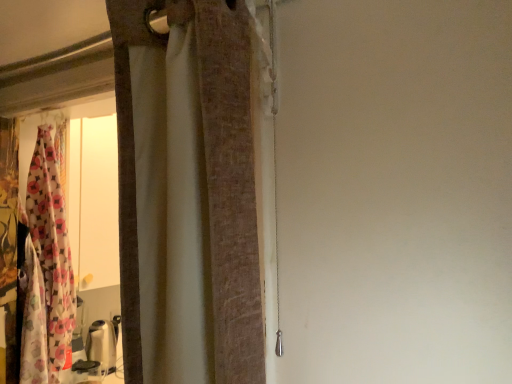
Question: Considering the relative sizes of textured beige curtain at center, which is counted as the first curtain, starting from the front, and floral fabric curtain at left, arranged as the first curtain when viewed from the back, in the image provided, is textured beige curtain at center, which is counted as the first curtain, starting from the front, bigger than floral fabric curtain at left, arranged as the first curtain when viewed from the back,?

Choices:
 (A) yes
 (B) no

Answer: (B)

Question: From a real-world perspective, does textured beige curtain at center, acting as the 2th curtain starting from the left, sit lower than floral fabric curtain at left, the second curtain in the right-to-left sequence?

Choices:
 (A) no
 (B) yes

Answer: (A)

Question: From a real-world perspective, is textured beige curtain at center, which is counted as the first curtain, starting from the front, on top of floral fabric curtain at left, the 2th curtain in the front-to-back sequence?

Choices:
 (A) yes
 (B) no

Answer: (A)

Question: Can you confirm if textured beige curtain at center, acting as the 2th curtain starting from the left, is taller than floral fabric curtain at left, the second curtain in the right-to-left sequence?

Choices:
 (A) no
 (B) yes

Answer: (A)

Question: Is textured beige curtain at center, placed as the 2th curtain when sorted from back to front, looking in the opposite direction of floral fabric curtain at left, the 2th curtain in the front-to-back sequence?

Choices:
 (A) yes
 (B) no

Answer: (B)

Question: Does textured beige curtain at center, which is counted as the first curtain, starting from the front, have a greater width compared to floral fabric curtain at left, the second curtain in the right-to-left sequence?

Choices:
 (A) no
 (B) yes

Answer: (A)

Question: Does floral fabric curtain at left, the 2th curtain in the front-to-back sequence, have a greater width compared to textured beige curtain at center, placed as the 2th curtain when sorted from back to front?

Choices:
 (A) no
 (B) yes

Answer: (B)

Question: Does floral fabric curtain at left, arranged as the first curtain when viewed from the back, contain textured beige curtain at center, which is the first curtain from right to left?

Choices:
 (A) yes
 (B) no

Answer: (B)

Question: From the image's perspective, would you say floral fabric curtain at left, the 2th curtain in the front-to-back sequence, is shown under textured beige curtain at center, placed as the 2th curtain when sorted from back to front?

Choices:
 (A) yes
 (B) no

Answer: (A)

Question: From a real-world perspective, is floral fabric curtain at left, the 1th curtain viewed from the left, on top of textured beige curtain at center, which is the first curtain from right to left?

Choices:
 (A) no
 (B) yes

Answer: (A)

Question: Can you confirm if floral fabric curtain at left, arranged as the first curtain when viewed from the back, is positioned to the right of textured beige curtain at center, which is counted as the first curtain, starting from the front?

Choices:
 (A) yes
 (B) no

Answer: (B)

Question: Is floral fabric curtain at left, arranged as the first curtain when viewed from the back, not inside textured beige curtain at center, which is the first curtain from right to left?

Choices:
 (A) yes
 (B) no

Answer: (A)

Question: Is textured beige curtain at center, acting as the 2th curtain starting from the left, bigger or smaller than floral fabric curtain at left, the 2th curtain in the front-to-back sequence?

Choices:
 (A) small
 (B) big

Answer: (A)